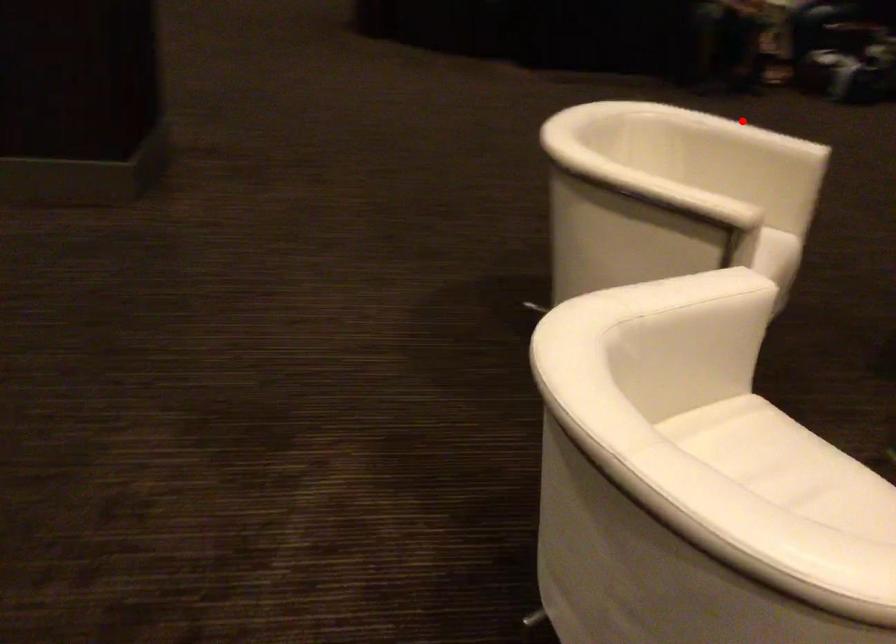
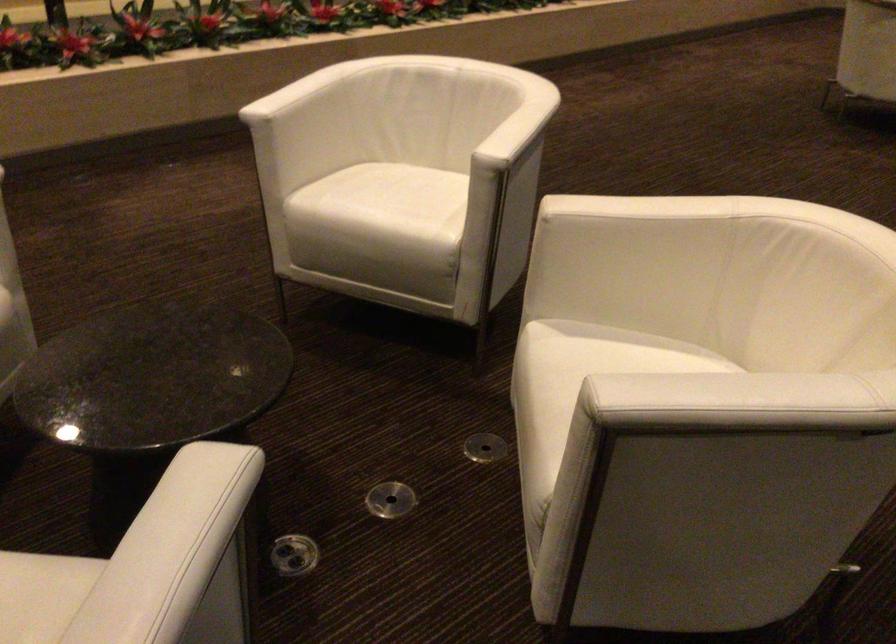
The point at the highlighted location is marked in the first image. Where is the corresponding point in the second image?

(737, 402)